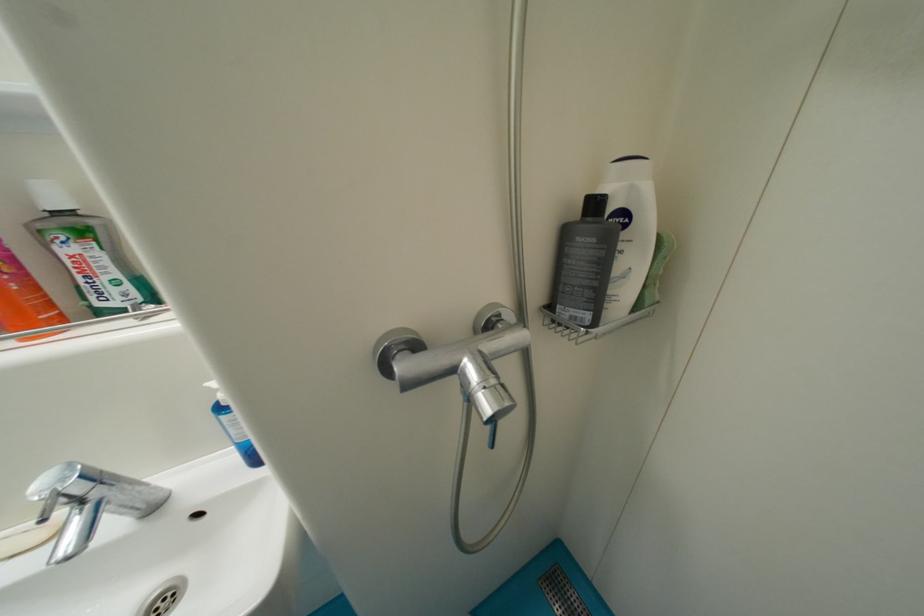
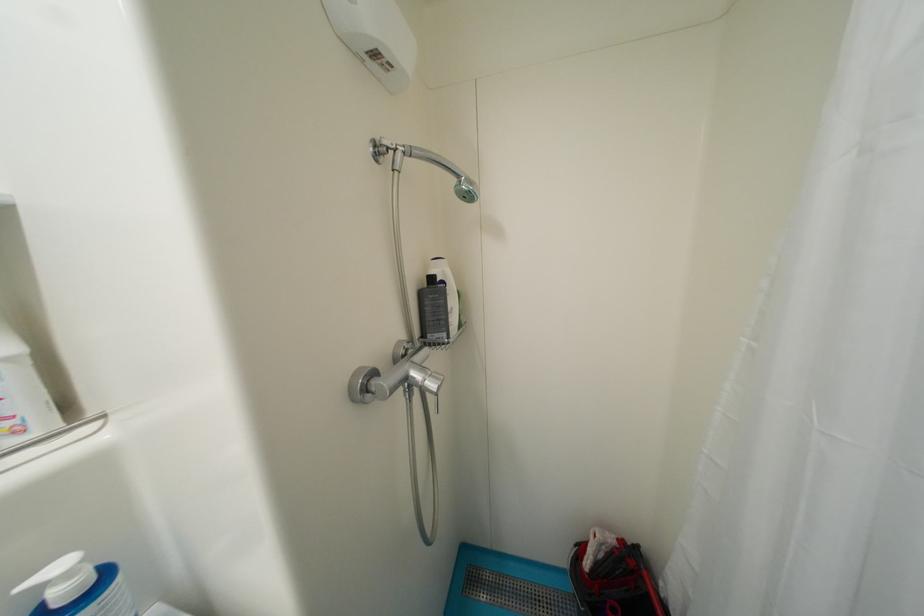
Locate, in the second image, the point that corresponds to point 601,206 in the first image.

(439, 281)